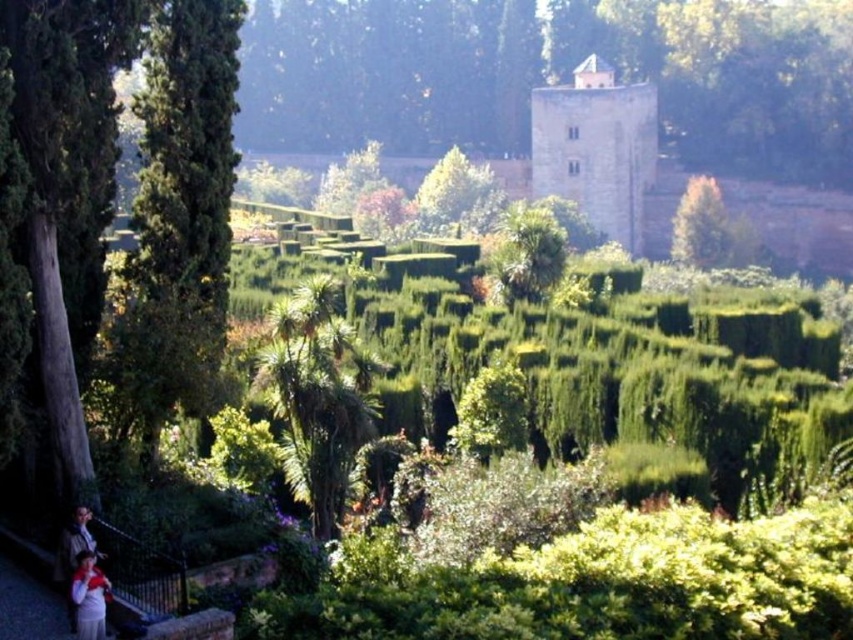
Is green textured tree at left smaller than matte white shirt at lower left?

No.

Between green textured tree at left and matte white shirt at lower left, which one has less height?

matte white shirt at lower left is shorter.

This screenshot has width=853, height=640. Find the location of `green textured tree at left`. green textured tree at left is located at coordinates (132, 202).

Find the location of a particular element. green textured tree at left is located at coordinates (132, 202).

Can you confirm if green leafy tree at upper center is positioned below green leafy tree at upper right?

No, green leafy tree at upper center is not below green leafy tree at upper right.

Does green leafy tree at upper center appear on the right side of green leafy tree at upper right?

Incorrect, green leafy tree at upper center is not on the right side of green leafy tree at upper right.

Where is `green leafy tree at upper center`? Image resolution: width=853 pixels, height=640 pixels. green leafy tree at upper center is located at coordinates (553, 76).

Does point (361, 422) lie behind point (776, 224)?

No.

Identify the location of green leafy palm at center. (317, 396).

Identify the location of green leafy palm at center. (317, 396).